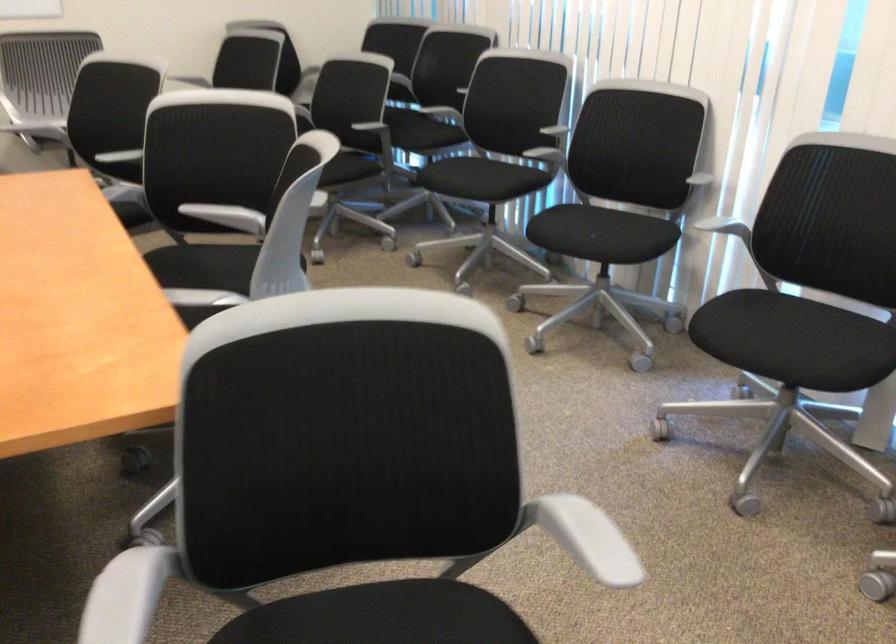
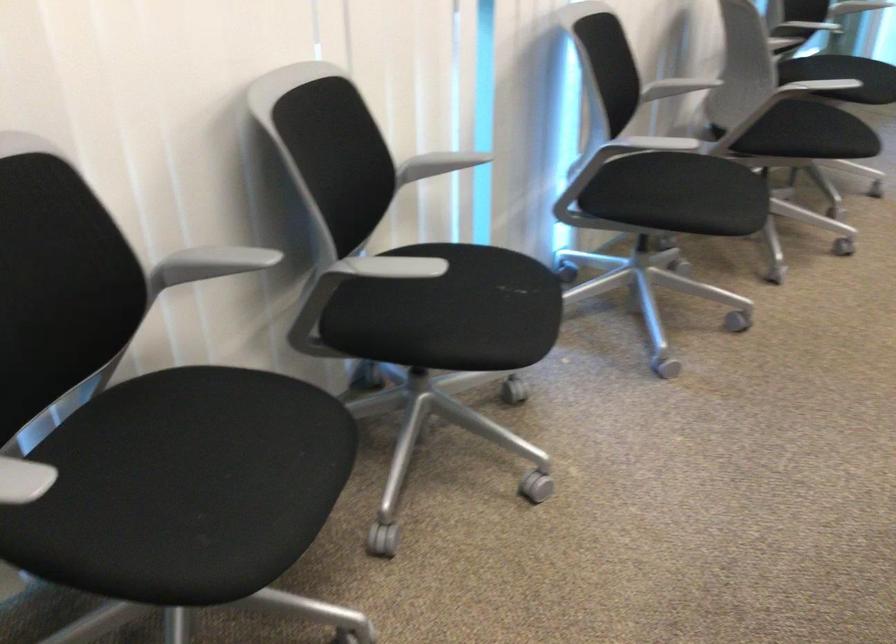
In the second image, find the point that corresponds to [592,241] in the first image.

(515, 287)